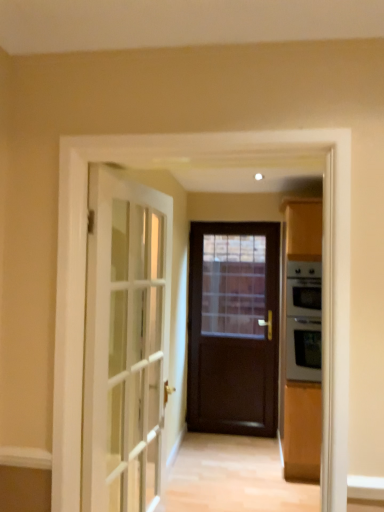
Image resolution: width=384 pixels, height=512 pixels. Describe the element at coordinates (233, 328) in the screenshot. I see `dark wood door at center, which is counted as the 2th door, starting from the left` at that location.

Locate an element on the screen. silver metallic oven at right is located at coordinates (303, 321).

This screenshot has width=384, height=512. I want to click on white glass door at left, which is the 1th door from left to right, so click(x=125, y=343).

At what (x,y) coordinates should I click in order to perform the action: click on dark wood door at center, which ranks as the first door in right-to-left order. Please return your answer as a coordinate pair (x, y). The image size is (384, 512). Looking at the image, I should click on (x=233, y=328).

How far apart are silver metallic oven at right and white glass door at left, which is the second door in back-to-front order?

They are 4.79 feet apart.

Who is taller, silver metallic oven at right or white glass door at left, which is the 1th door from left to right?

With more height is white glass door at left, which is the 1th door from left to right.

Would you say silver metallic oven at right is to the left or to the right of white glass door at left, which is the 1th door from left to right, in the picture?

In the image, silver metallic oven at right appears on the right side of white glass door at left, which is the 1th door from left to right.

Is white glass door at left, placed as the second door when sorted from right to left, surrounded by silver metallic oven at right?

No, white glass door at left, placed as the second door when sorted from right to left, is not inside silver metallic oven at right.

From a real-world perspective, between silver metallic oven at right and dark wood door at center, which is counted as the 2th door, starting from the left, who is vertically lower?

dark wood door at center, which is counted as the 2th door, starting from the left, from a real-world perspective.

Which of these two, silver metallic oven at right or dark wood door at center, positioned as the second door in front-to-back order, is wider?

silver metallic oven at right is wider.

How much distance is there between silver metallic oven at right and dark wood door at center, which is counted as the 2th door, starting from the left?

A distance of 35.47 inches exists between silver metallic oven at right and dark wood door at center, which is counted as the 2th door, starting from the left.

Which object is positioned more to the right, silver metallic oven at right or dark wood door at center, the first door in the back-to-front sequence?

Positioned to the right is silver metallic oven at right.

Do you think white glass door at left, the first door positioned from the front, is within dark wood door at center, positioned as the second door in front-to-back order, or outside of it?

white glass door at left, the first door positioned from the front, is not inside dark wood door at center, positioned as the second door in front-to-back order, it's outside.

In terms of height, does white glass door at left, the first door positioned from the front, look taller or shorter compared to dark wood door at center, which is counted as the 2th door, starting from the left?

Clearly, white glass door at left, the first door positioned from the front, is shorter compared to dark wood door at center, which is counted as the 2th door, starting from the left.

Is white glass door at left, the first door positioned from the front, looking in the opposite direction of dark wood door at center, positioned as the second door in front-to-back order?

white glass door at left, the first door positioned from the front, is not turned away from dark wood door at center, positioned as the second door in front-to-back order.

Is silver metallic oven at right a part of dark wood door at center, the first door in the back-to-front sequence?

Definitely not — silver metallic oven at right is not inside dark wood door at center, the first door in the back-to-front sequence.

Considering the sizes of objects dark wood door at center, the first door in the back-to-front sequence, and silver metallic oven at right in the image provided, who is wider, dark wood door at center, the first door in the back-to-front sequence, or silver metallic oven at right?

silver metallic oven at right.

Is point (253, 355) positioned before point (310, 309)?

That is False.

Is dark wood door at center, which ranks as the first door in right-to-left order, turned away from silver metallic oven at right?

No, dark wood door at center, which ranks as the first door in right-to-left order,'s orientation is not away from silver metallic oven at right.

Considering the positions of objects white glass door at left, placed as the second door when sorted from right to left, and silver metallic oven at right in the image provided, who is in front, white glass door at left, placed as the second door when sorted from right to left, or silver metallic oven at right?

Positioned in front is white glass door at left, placed as the second door when sorted from right to left.

From a real-world perspective, is white glass door at left, which is the second door in back-to-front order, physically below silver metallic oven at right?

Yes.

Between white glass door at left, which is the second door in back-to-front order, and silver metallic oven at right, which one has larger size?

Bigger between the two is silver metallic oven at right.

Considering the positions of objects white glass door at left, the first door positioned from the front, and silver metallic oven at right in the image provided, who is more to the right, white glass door at left, the first door positioned from the front, or silver metallic oven at right?

silver metallic oven at right is more to the right.

Which of these two, dark wood door at center, positioned as the second door in front-to-back order, or white glass door at left, which is the second door in back-to-front order, is smaller?

With smaller size is dark wood door at center, positioned as the second door in front-to-back order.

Considering the relative sizes of dark wood door at center, the first door in the back-to-front sequence, and white glass door at left, which is the second door in back-to-front order, in the image provided, is dark wood door at center, the first door in the back-to-front sequence, wider than white glass door at left, which is the second door in back-to-front order,?

No, dark wood door at center, the first door in the back-to-front sequence, is not wider than white glass door at left, which is the second door in back-to-front order.

How different are the orientations of dark wood door at center, which is counted as the 2th door, starting from the left, and white glass door at left, which is the second door in back-to-front order, in degrees?

83.7 degrees.

Which is less distant, [238,329] or [97,310]?

Point [238,329] appears to be farther away from the viewer than point [97,310].

The width and height of the screenshot is (384, 512). I want to click on appliance that appears below the white glass door at left, placed as the second door when sorted from right to left (from the image's perspective), so click(x=303, y=321).

Identify the location of appliance located in front of the dark wood door at center, the first door in the back-to-front sequence. The image size is (384, 512). (303, 321).

Based on their spatial positions, is white glass door at left, the first door positioned from the front, or silver metallic oven at right further from dark wood door at center, which ranks as the first door in right-to-left order?

Among the two, white glass door at left, the first door positioned from the front, is located further to dark wood door at center, which ranks as the first door in right-to-left order.

Looking at this image, which object lies nearer to the anchor point silver metallic oven at right, dark wood door at center, positioned as the second door in front-to-back order, or white glass door at left, the first door positioned from the front?

dark wood door at center, positioned as the second door in front-to-back order, is positioned closer to the anchor silver metallic oven at right.

Based on their spatial positions, is silver metallic oven at right or white glass door at left, the first door positioned from the front, closer to dark wood door at center, the first door in the back-to-front sequence?

silver metallic oven at right.

Which object lies further to the anchor point white glass door at left, placed as the second door when sorted from right to left, silver metallic oven at right or dark wood door at center, which ranks as the first door in right-to-left order?

dark wood door at center, which ranks as the first door in right-to-left order, is positioned further to the anchor white glass door at left, placed as the second door when sorted from right to left.

Considering their positions, is dark wood door at center, which is counted as the 2th door, starting from the left, positioned further to white glass door at left, which is the second door in back-to-front order, than silver metallic oven at right?

Among the two, dark wood door at center, which is counted as the 2th door, starting from the left, is located further to white glass door at left, which is the second door in back-to-front order.

From the image, which object appears to be nearer to silver metallic oven at right, white glass door at left, the first door positioned from the front, or dark wood door at center, which is counted as the 2th door, starting from the left?

The object closer to silver metallic oven at right is dark wood door at center, which is counted as the 2th door, starting from the left.

Find the location of a particular element. This screenshot has width=384, height=512. appliance located between white glass door at left, which is the second door in back-to-front order, and dark wood door at center, which is counted as the 2th door, starting from the left, in the depth direction is located at coordinates (303, 321).